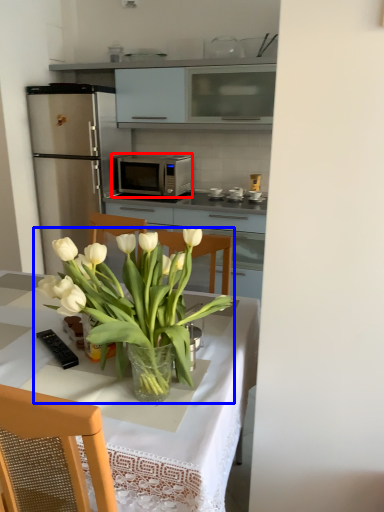
Question: Among these objects, which one is nearest to the camera, microwave oven (highlighted by a red box) or houseplant (highlighted by a blue box)?

Choices:
 (A) microwave oven
 (B) houseplant

Answer: (B)